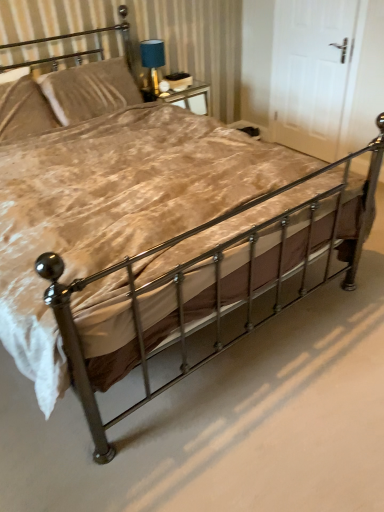
Question: Considering the relative sizes of velvet beige pillow at upper left, marked as the 2th pillow in a right-to-left arrangement, and white matte door at upper right in the image provided, is velvet beige pillow at upper left, marked as the 2th pillow in a right-to-left arrangement, shorter than white matte door at upper right?

Choices:
 (A) no
 (B) yes

Answer: (B)

Question: From a real-world perspective, is velvet beige pillow at upper left, marked as the first pillow in a left-to-right arrangement, over white matte door at upper right?

Choices:
 (A) yes
 (B) no

Answer: (A)

Question: Is velvet beige pillow at upper left, marked as the first pillow in a left-to-right arrangement, to the right of white matte door at upper right from the viewer's perspective?

Choices:
 (A) no
 (B) yes

Answer: (A)

Question: Is velvet beige pillow at upper left, marked as the first pillow in a left-to-right arrangement, in front of white matte door at upper right?

Choices:
 (A) no
 (B) yes

Answer: (B)

Question: Considering the relative positions of velvet beige pillow at upper left, marked as the 2th pillow in a right-to-left arrangement, and white matte door at upper right in the image provided, is velvet beige pillow at upper left, marked as the 2th pillow in a right-to-left arrangement, behind white matte door at upper right?

Choices:
 (A) no
 (B) yes

Answer: (A)

Question: Considering the positions of white matte door at upper right and blue fabric lampshade at upper center in the image, is white matte door at upper right taller or shorter than blue fabric lampshade at upper center?

Choices:
 (A) short
 (B) tall

Answer: (B)

Question: Does point (279, 74) appear closer or farther from the camera than point (155, 92)?

Choices:
 (A) farther
 (B) closer

Answer: (A)

Question: From a real-world perspective, relative to blue fabric lampshade at upper center, is white matte door at upper right vertically above or below?

Choices:
 (A) below
 (B) above

Answer: (A)

Question: In the image, is white matte door at upper right on the left side or the right side of blue fabric lampshade at upper center?

Choices:
 (A) left
 (B) right

Answer: (B)

Question: Looking at their shapes, would you say metallic gold headboard at upper left is wider or thinner than polished metal bed frame at center?

Choices:
 (A) thin
 (B) wide

Answer: (A)

Question: Does point (127, 46) appear closer or farther from the camera than point (158, 393)?

Choices:
 (A) closer
 (B) farther

Answer: (B)

Question: Considering the relative positions of metallic gold headboard at upper left and polished metal bed frame at center in the image provided, is metallic gold headboard at upper left to the left or to the right of polished metal bed frame at center?

Choices:
 (A) left
 (B) right

Answer: (A)

Question: In the image, is metallic gold headboard at upper left positioned in front of or behind polished metal bed frame at center?

Choices:
 (A) behind
 (B) front

Answer: (A)

Question: From the image's perspective, is metallic gold headboard at upper left located above or below velvet beige pillow at upper left, marked as the first pillow in a left-to-right arrangement?

Choices:
 (A) above
 (B) below

Answer: (A)

Question: Relative to velvet beige pillow at upper left, marked as the first pillow in a left-to-right arrangement, is metallic gold headboard at upper left in front or behind?

Choices:
 (A) front
 (B) behind

Answer: (B)